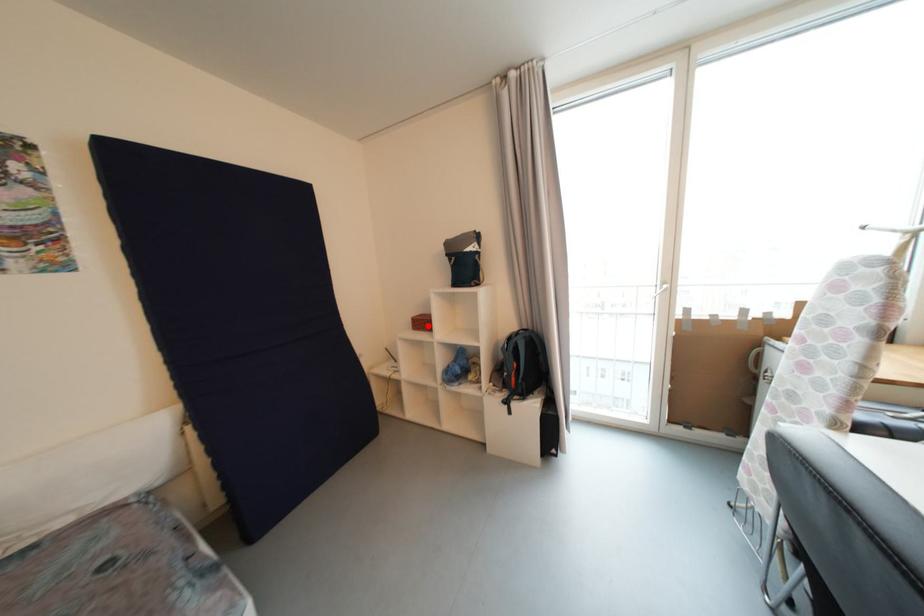
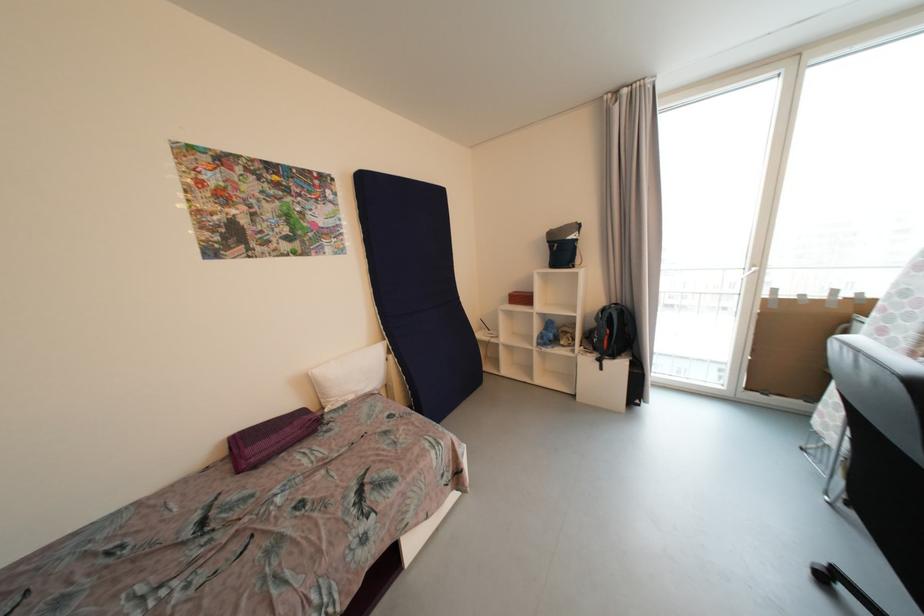
Find the pixel in the second image that matches the highlighted location in the first image.

(528, 300)